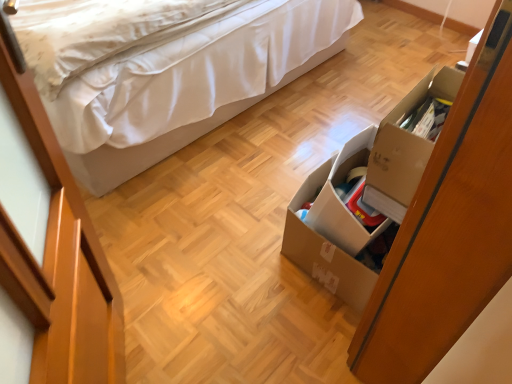
Question: Would you say white fabric bed at upper left is to the left or to the right of cardboard box at right in the picture?

Choices:
 (A) right
 (B) left

Answer: (B)

Question: From their relative heights in the image, would you say white fabric bed at upper left is taller or shorter than cardboard box at right?

Choices:
 (A) tall
 (B) short

Answer: (A)

Question: Which is farther from the brown cardboard box at lower right?

Choices:
 (A) white fabric bed at upper left
 (B) cardboard box at right

Answer: (A)

Question: Which object is positioned closest to the brown cardboard box at lower right?

Choices:
 (A) white fabric bed at upper left
 (B) cardboard box at right

Answer: (B)